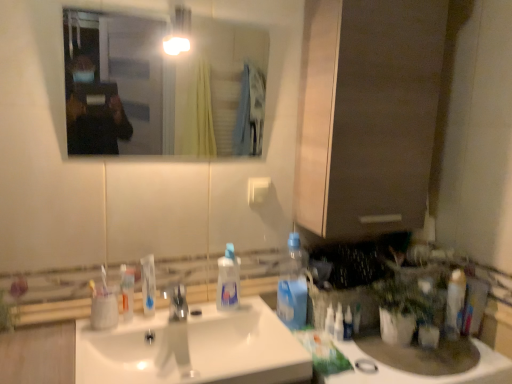
This screenshot has height=384, width=512. Identify the location of free space in front of clear plastic spray bottle at right, which ranks as the third cleaning product in left-to-right order. (354, 364).